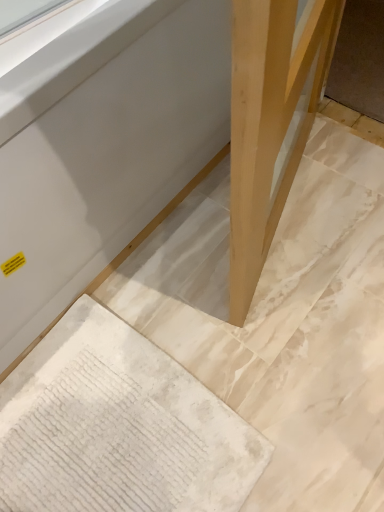
Find the location of a particular element. The width and height of the screenshot is (384, 512). vacant space underneath natural wood leg at center (from a real-world perspective) is located at coordinates (286, 215).